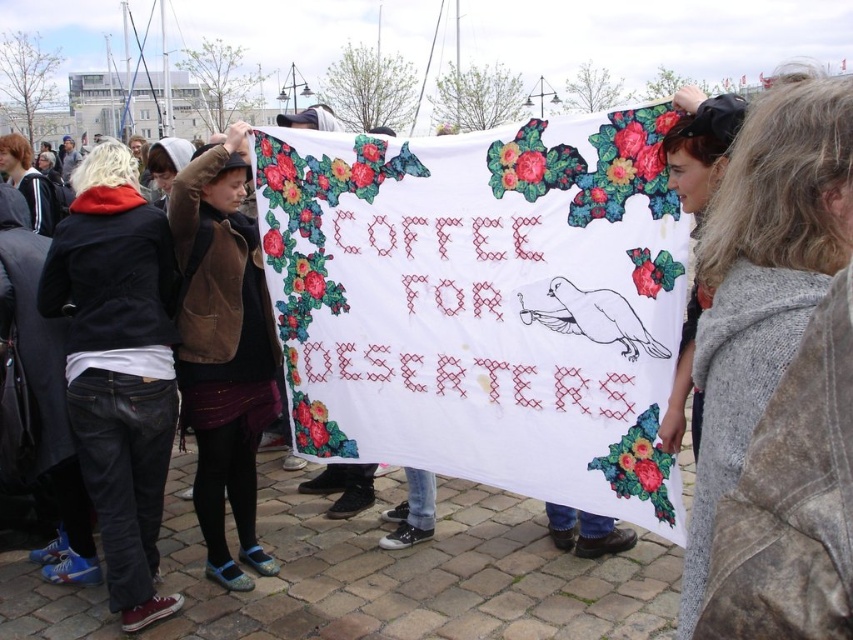
You are a fashion designer observing the group holding the banner. You need to determine which clothing item, the gray knit sweater at center or the matte black jacket at left, would require more fabric to make a longer version. Which one would it be?

The gray knit sweater at center is shorter than the matte black jacket at left, so to make a longer version of the matte black jacket at left would require more fabric since it is already longer.

You are a photographer trying to capture a group photo of the people holding the banner. You want to ensure that both the brown suede jacket at center and the matte black jacket at left are in focus. Given that your camera has a depth of field that can cover 8 feet, will both jackets be in focus?

The distance between the brown suede jacket at center and the matte black jacket at left is 8.72 feet, which exceeds the camera depth of field of 8 feet. Therefore, both jackets may not be in focus simultaneously.

You are a photographer trying to capture the banner clearly. You notice two people in the foreground wearing a gray knit sweater at center and a matte black jacket at left. Which clothing item is closer to the camera?

The gray knit sweater at center is located below the matte black jacket at left, meaning it is closer to the camera since it appears lower in the image.